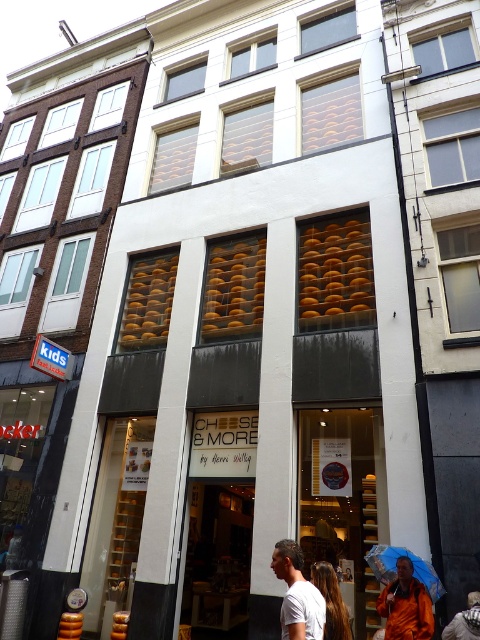
Question: Can you confirm if white matte t-shirt at center is bigger than blue fabric umbrella at lower center?

Choices:
 (A) no
 (B) yes

Answer: (A)

Question: Which point is closer to the camera?

Choices:
 (A) (388, 579)
 (B) (403, 620)

Answer: (B)

Question: Does white matte t-shirt at center come behind orange fabric umbrella at center?

Choices:
 (A) yes
 (B) no

Answer: (B)

Question: Among these objects, which one is nearest to the camera?

Choices:
 (A) blue fabric umbrella at lower center
 (B) orange fabric umbrella at center

Answer: (B)

Question: Can you confirm if orange fabric umbrella at center is positioned below blue fabric umbrella at lower center?

Choices:
 (A) no
 (B) yes

Answer: (B)

Question: Which point is closer to the camera taking this photo?

Choices:
 (A) (317, 628)
 (B) (418, 566)

Answer: (A)